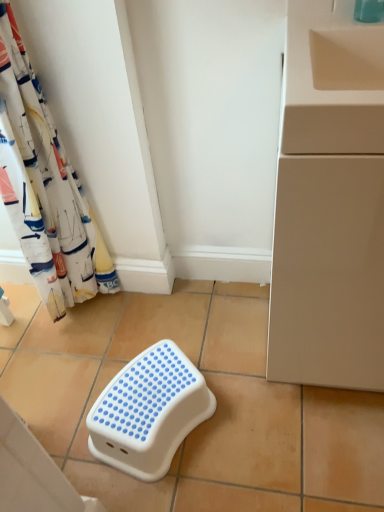
At what (x,y) coordinates should I click in order to perform the action: click on free space that is to the left of white plastic step stool at center. Please return your answer as a coordinate pair (x, y). The image size is (384, 512). Looking at the image, I should click on pyautogui.click(x=75, y=410).